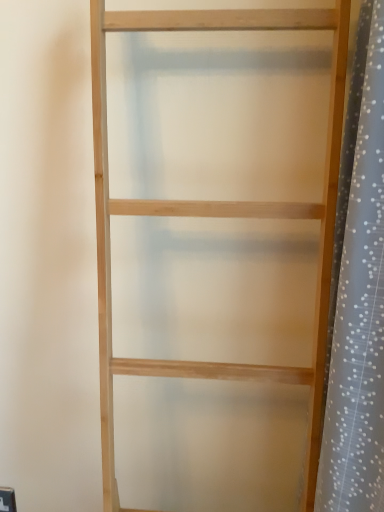
Question: Should I look upward or downward to see white dotted fabric at right?

Choices:
 (A) down
 (B) up

Answer: (A)

Question: Is natural wood shelf at center placed right next to white dotted fabric at right?

Choices:
 (A) yes
 (B) no

Answer: (B)

Question: Considering the relative sizes of natural wood shelf at center and white dotted fabric at right in the image provided, is natural wood shelf at center shorter than white dotted fabric at right?

Choices:
 (A) yes
 (B) no

Answer: (B)

Question: From a real-world perspective, is natural wood shelf at center positioned under white dotted fabric at right based on gravity?

Choices:
 (A) no
 (B) yes

Answer: (B)

Question: Can you confirm if natural wood shelf at center is thinner than white dotted fabric at right?

Choices:
 (A) yes
 (B) no

Answer: (B)

Question: Does natural wood shelf at center have a smaller size compared to white dotted fabric at right?

Choices:
 (A) no
 (B) yes

Answer: (A)

Question: Is natural wood shelf at center positioned beyond the bounds of white dotted fabric at right?

Choices:
 (A) yes
 (B) no

Answer: (A)

Question: Is white dotted fabric at right taller than natural wood shelf at center?

Choices:
 (A) no
 (B) yes

Answer: (A)

Question: Can you confirm if white dotted fabric at right is positioned to the right of natural wood shelf at center?

Choices:
 (A) yes
 (B) no

Answer: (A)

Question: Is white dotted fabric at right closer to the viewer compared to natural wood shelf at center?

Choices:
 (A) yes
 (B) no

Answer: (B)

Question: Can you confirm if white dotted fabric at right is smaller than natural wood shelf at center?

Choices:
 (A) no
 (B) yes

Answer: (B)

Question: Does white dotted fabric at right turn towards natural wood shelf at center?

Choices:
 (A) yes
 (B) no

Answer: (A)

Question: Is white dotted fabric at right further to the viewer compared to natural wood shelf at center?

Choices:
 (A) no
 (B) yes

Answer: (B)

Question: Visually, is natural wood shelf at center positioned to the left or to the right of white dotted fabric at right?

Choices:
 (A) left
 (B) right

Answer: (A)